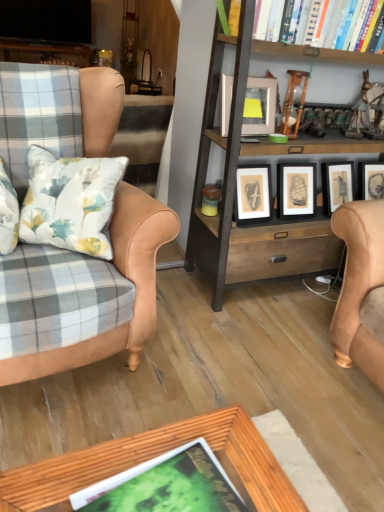
Question: In the image, is hardcover book at upper right, which is the 1th book from right to left, positioned in front of or behind wooden bookcase at center?

Choices:
 (A) front
 (B) behind

Answer: (B)

Question: Based on their sizes in the image, would you say hardcover book at upper right, the 1th book viewed from the top, is bigger or smaller than wooden bookcase at center?

Choices:
 (A) small
 (B) big

Answer: (A)

Question: Which object is positioned farthest from the wooden bookcase at center?

Choices:
 (A) hardcover book at upper right, placed as the second book when sorted from bottom to top
 (B) leather armchair at left
 (C) matte silver picture frame at upper center
 (D) green matte book at lower center, which ranks as the first book in bottom-to-top order

Answer: (D)

Question: Which object is positioned closest to the matte silver picture frame at upper center?

Choices:
 (A) leather armchair at left
 (B) wooden bookcase at center
 (C) hardcover book at upper right, arranged as the 2th book when viewed from the left
 (D) green matte book at lower center, acting as the second book starting from the back

Answer: (B)